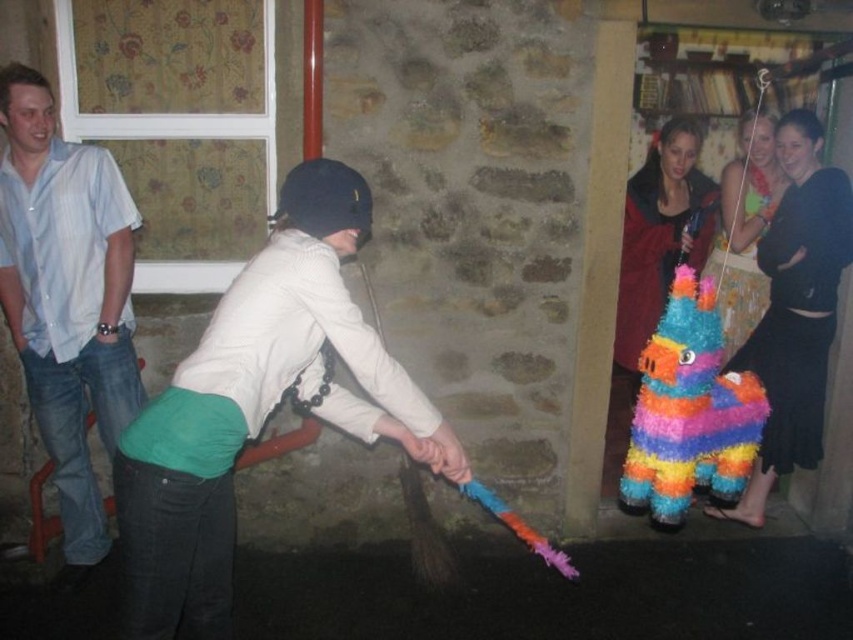
From the picture: You are standing at the position of the person in the image. The white matte helmet at center is on the ground in front of you. You want to pick it up without moving your feet. Can you reach it?

The white matte helmet at center is 6.40 feet away from the person, which is beyond the typical human arm reach. You cannot reach it without moving your feet.

You are a safety inspector checking the distance between the white matte helmet at center and the multicolored paper pinata at center. According to safety regulations, the minimum safe distance between a helmet and a swinging object is 40 inches. Is the current distance compliant with the safety standards?

The white matte helmet at center is 38.61 inches from the multicolored paper pinata at center. Since the required minimum distance is 40 inches, the current distance is below the safety standard and does not comply.

You are at the point labeled as point [257,404]. What object is located at this point?

The white matte helmet at center is located at point [257,404].